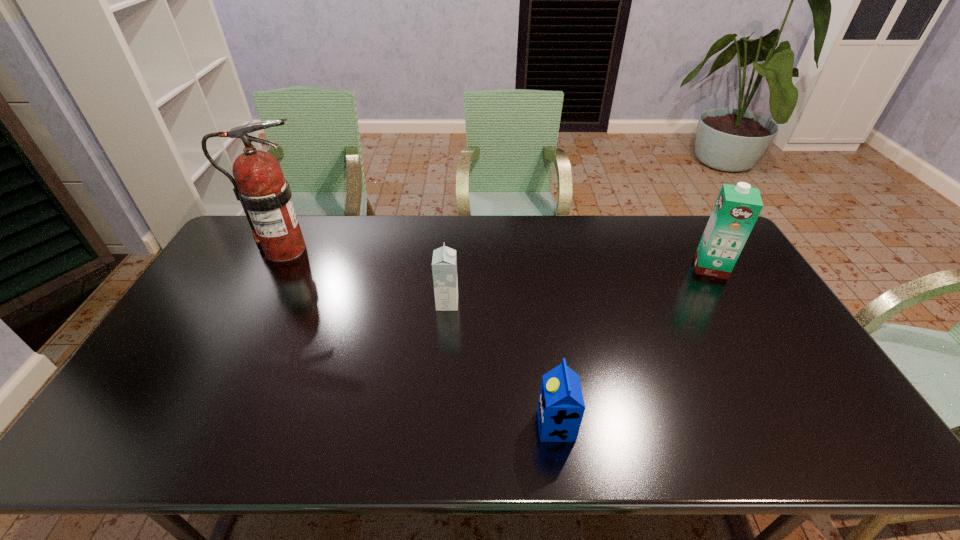
I want to click on fire extinguisher, so click(x=265, y=195).

Identify the location of the leftmost object. (265, 195).

Where is `the rightmost object`? the rightmost object is located at coordinates (737, 207).

Identify the location of the tallest carton. The image size is (960, 540). (737, 207).

In order to click on the second object from left to right in this screenshot , I will do `click(444, 262)`.

At what (x,y) coordinates should I click in order to perform the action: click on the third farthest object. Please return your answer as a coordinate pair (x, y). Looking at the image, I should click on (444, 262).

The width and height of the screenshot is (960, 540). In order to click on the second object from right to left in this screenshot , I will do `click(561, 407)`.

Where is `the nearest object`? The image size is (960, 540). the nearest object is located at coordinates (561, 407).

The height and width of the screenshot is (540, 960). I want to click on vacant space positioned at the nozzle of the fire extinguisher, so point(355,249).

Locate an element on the screen. vacant space located 0.110m on the front of the rightmost carton is located at coordinates (732, 304).